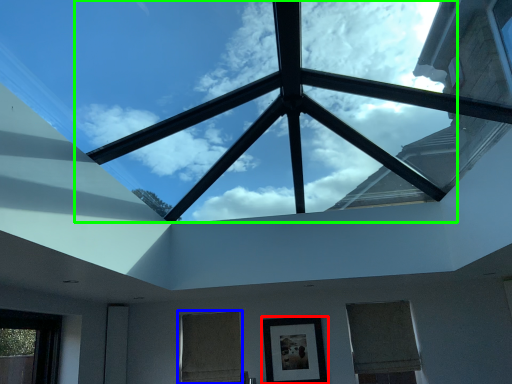
Question: Which is nearer to the picture frame (highlighted by a red box)? window (highlighted by a blue box) or cloud (highlighted by a green box).

Choices:
 (A) window
 (B) cloud

Answer: (A)